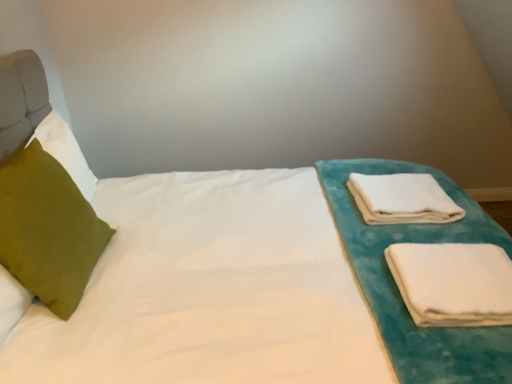
Question: Is the surface of white soft towel at right, which is the 1th cloth from back to front, in direct contact with white soft cloth at right, which is the first cloth from bottom to top?

Choices:
 (A) yes
 (B) no

Answer: (B)

Question: Would you say white soft towel at right, which is the 1th cloth from back to front, contains white soft cloth at right, marked as the second cloth in a back-to-front arrangement?

Choices:
 (A) yes
 (B) no

Answer: (B)

Question: Can you confirm if white soft towel at right, which ranks as the 1th cloth in top-to-bottom order, is positioned to the left of white soft cloth at right, the 2th cloth in the top-to-bottom sequence?

Choices:
 (A) yes
 (B) no

Answer: (A)

Question: From the image's perspective, is white soft towel at right, which is the 1th cloth from back to front, located above white soft cloth at right, the 2th cloth in the top-to-bottom sequence?

Choices:
 (A) yes
 (B) no

Answer: (A)

Question: Is white soft towel at right, which is the 1th cloth from back to front, positioned beyond the bounds of white soft cloth at right, which is the first cloth in front-to-back order?

Choices:
 (A) no
 (B) yes

Answer: (B)

Question: Can you confirm if white soft towel at right, which ranks as the 1th cloth in top-to-bottom order, is smaller than white soft cloth at right, marked as the second cloth in a back-to-front arrangement?

Choices:
 (A) yes
 (B) no

Answer: (B)

Question: Can you confirm if green velvet pillow at left is taller than white soft towel at right, which is counted as the second cloth, starting from the bottom?

Choices:
 (A) no
 (B) yes

Answer: (B)

Question: From a real-world perspective, is green velvet pillow at left located higher than white soft towel at right, the second cloth from the front?

Choices:
 (A) yes
 (B) no

Answer: (A)

Question: Could you tell me if green velvet pillow at left is facing white soft towel at right, which ranks as the 1th cloth in top-to-bottom order?

Choices:
 (A) no
 (B) yes

Answer: (B)

Question: Is green velvet pillow at left wider than white soft towel at right, which ranks as the 1th cloth in top-to-bottom order?

Choices:
 (A) yes
 (B) no

Answer: (B)

Question: Does green velvet pillow at left appear on the left side of white soft towel at right, which ranks as the 1th cloth in top-to-bottom order?

Choices:
 (A) no
 (B) yes

Answer: (B)

Question: From the image's perspective, is green velvet pillow at left on top of white soft towel at right, which is counted as the second cloth, starting from the bottom?

Choices:
 (A) no
 (B) yes

Answer: (A)

Question: From a real-world perspective, is white soft cloth at right, the 2th cloth in the top-to-bottom sequence, beneath green velvet pillow at left?

Choices:
 (A) no
 (B) yes

Answer: (B)